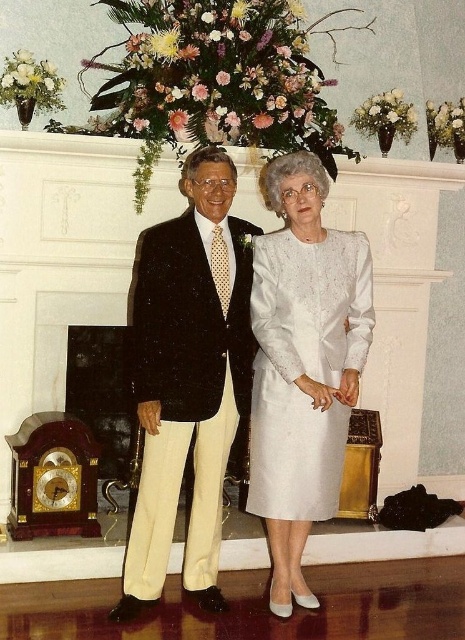
Looking at this image, you are a photographer setting up for a formal event. You need to adjust the camera height to capture both the matte black suit at center and the white satin dress at center in the best possible way. Considering their heights, which one should you focus on first to ensure proper framing?

The matte black suit at center is much taller than the white satin dress at center, so you should focus on the matte black suit at center first to ensure proper framing.

In the scene shown: You are a photographer setting up for a group photo. The subjects are wearing the matte black suit at center and the white satin dress at center. You need to ensure there is enough space between them for a natural pose. The minimum recommended distance for such a pose is 30 centimeters. Is the current distance sufficient?

The matte black suit at center is 25.09 centimeters away from the white satin dress at center. Since the minimum recommended distance is 30 centimeters, the current distance is insufficient. They need to move slightly apart to achieve the required spacing.

You are a photographer setting up for a formal event. You need to position a spotlight on the left side of the white satin dress at center. Based on the scene, where should you aim the spotlight relative to the matte black suit at center?

The matte black suit at center is to the left of the white satin dress at center, so the spotlight should be placed to the right of the matte black suit at center to be on the left side of the dress.